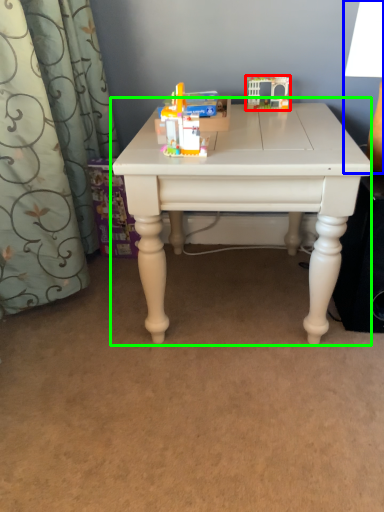
Question: Based on their relative distances, which object is farther from toy (highlighted by a red box)? Choose from table lamp (highlighted by a blue box) and table (highlighted by a green box).

Choices:
 (A) table lamp
 (B) table

Answer: (B)